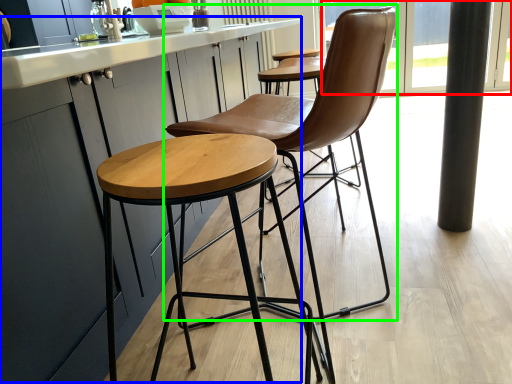
Question: Which is farther away from window screen (highlighted by a red box)? counter top (highlighted by a blue box) or chair (highlighted by a green box)?

Choices:
 (A) counter top
 (B) chair

Answer: (B)